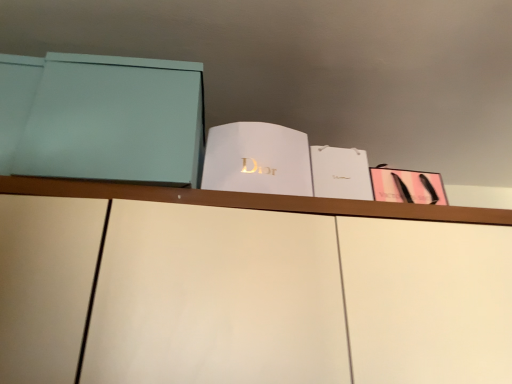
What is the approximate height of white paper at center, acting as the second paperback book starting from the left?

white paper at center, acting as the second paperback book starting from the left, is 7.68 inches tall.

Image resolution: width=512 pixels, height=384 pixels. What do you see at coordinates (340, 173) in the screenshot?
I see `white paper at center, which appears as the second paperback book when viewed from the right` at bounding box center [340, 173].

Where is `pink matte paper at upper right, positioned as the 1th paperback book in right-to-left order`? pink matte paper at upper right, positioned as the 1th paperback book in right-to-left order is located at coordinates (407, 186).

Identify the location of white paper at center, acting as the second paperback book starting from the left. (257, 159).

Is matte teal box at left, marked as the first paperback book in a left-to-right arrangement, looking in the opposite direction of pink matte paper at upper right, which is counted as the fourth paperback book, starting from the left?

No, matte teal box at left, marked as the first paperback book in a left-to-right arrangement, is not facing the opposite direction of pink matte paper at upper right, which is counted as the fourth paperback book, starting from the left.

In order to click on paperback book that is the 3rd object directly below the matte teal box at left, marked as the first paperback book in a left-to-right arrangement (from a real-world perspective) in this screenshot , I will do `click(407, 186)`.

Between matte teal box at left, which is the 4th paperback book in right-to-left order, and pink matte paper at upper right, which is counted as the fourth paperback book, starting from the left, which one has smaller width?

With smaller width is pink matte paper at upper right, which is counted as the fourth paperback book, starting from the left.

From the image's perspective, is matte teal box at left, marked as the first paperback book in a left-to-right arrangement, above pink matte paper at upper right, positioned as the 1th paperback book in right-to-left order?

Indeed, from the image's perspective, matte teal box at left, marked as the first paperback book in a left-to-right arrangement, is shown above pink matte paper at upper right, positioned as the 1th paperback book in right-to-left order.

Considering the positions of points (344, 160) and (130, 120), is point (344, 160) closer to camera compared to point (130, 120)?

No, it is not.

Does white paper at center, which appears as the second paperback book when viewed from the right, come in front of matte teal box at left, marked as the first paperback book in a left-to-right arrangement?

No.

Is white paper at center, which appears as the second paperback book when viewed from the right, wider than matte teal box at left, marked as the first paperback book in a left-to-right arrangement?

No.

Could you measure the distance between white paper at center, arranged as the 3th paperback book when viewed from the left, and matte teal box at left, marked as the first paperback book in a left-to-right arrangement?

A distance of 18.96 inches exists between white paper at center, arranged as the 3th paperback book when viewed from the left, and matte teal box at left, marked as the first paperback book in a left-to-right arrangement.

Measure the distance from pink matte paper at upper right, which is counted as the fourth paperback book, starting from the left, to white paper at center, acting as the second paperback book starting from the left.

pink matte paper at upper right, which is counted as the fourth paperback book, starting from the left, is 27.92 centimeters from white paper at center, acting as the second paperback book starting from the left.

From the image's perspective, which is below, pink matte paper at upper right, which is counted as the fourth paperback book, starting from the left, or white paper at center, marked as the 3th paperback book in a right-to-left arrangement?

pink matte paper at upper right, which is counted as the fourth paperback book, starting from the left, is shown below in the image.

Does pink matte paper at upper right, which is counted as the fourth paperback book, starting from the left, have a larger size compared to white paper at center, acting as the second paperback book starting from the left?

No, pink matte paper at upper right, which is counted as the fourth paperback book, starting from the left, is not bigger than white paper at center, acting as the second paperback book starting from the left.

Does pink matte paper at upper right, which is counted as the fourth paperback book, starting from the left, have a greater width compared to white paper at center, acting as the second paperback book starting from the left?

No, pink matte paper at upper right, which is counted as the fourth paperback book, starting from the left, is not wider than white paper at center, acting as the second paperback book starting from the left.

Between white paper at center, arranged as the 3th paperback book when viewed from the left, and pink matte paper at upper right, which is counted as the fourth paperback book, starting from the left, which one appears on the right side from the viewer's perspective?

pink matte paper at upper right, which is counted as the fourth paperback book, starting from the left.

Is point (323, 169) more distant than point (401, 184)?

That is False.

Choose the correct answer: Is white paper at center, arranged as the 3th paperback book when viewed from the left, inside pink matte paper at upper right, which is counted as the fourth paperback book, starting from the left, or outside it?

The correct answer is: outside.

The width and height of the screenshot is (512, 384). In order to click on paperback book to the right of white paper at center, which appears as the second paperback book when viewed from the right in this screenshot , I will do click(407, 186).

From the picture: Choose the correct answer: Is pink matte paper at upper right, positioned as the 1th paperback book in right-to-left order, inside white paper at center, which appears as the second paperback book when viewed from the right, or outside it?

pink matte paper at upper right, positioned as the 1th paperback book in right-to-left order, is outside white paper at center, which appears as the second paperback book when viewed from the right.

From a real-world perspective, between pink matte paper at upper right, positioned as the 1th paperback book in right-to-left order, and white paper at center, arranged as the 3th paperback book when viewed from the left, who is vertically higher?

In real-world perspective, white paper at center, arranged as the 3th paperback book when viewed from the left, is above.

Between pink matte paper at upper right, positioned as the 1th paperback book in right-to-left order, and white paper at center, which appears as the second paperback book when viewed from the right, which one appears on the right side from the viewer's perspective?

From the viewer's perspective, pink matte paper at upper right, positioned as the 1th paperback book in right-to-left order, appears more on the right side.

This screenshot has height=384, width=512. Find the location of `the 1st paperback book below the white paper at center, acting as the second paperback book starting from the left (from the image's perspective)`. the 1st paperback book below the white paper at center, acting as the second paperback book starting from the left (from the image's perspective) is located at coordinates (340, 173).

Is white paper at center, which appears as the second paperback book when viewed from the right, taller or shorter than white paper at center, acting as the second paperback book starting from the left?

In the image, white paper at center, which appears as the second paperback book when viewed from the right, appears to be shorter than white paper at center, acting as the second paperback book starting from the left.

Based on the photo, can you confirm if white paper at center, acting as the second paperback book starting from the left, is positioned to the right of white paper at center, which appears as the second paperback book when viewed from the right?

In fact, white paper at center, acting as the second paperback book starting from the left, is to the left of white paper at center, which appears as the second paperback book when viewed from the right.

From the image's perspective, which object appears higher, white paper at center, acting as the second paperback book starting from the left, or white paper at center, which appears as the second paperback book when viewed from the right?

From the image's view, white paper at center, acting as the second paperback book starting from the left, is above.

Is white paper at center, marked as the 3th paperback book in a right-to-left arrangement, situated inside white paper at center, which appears as the second paperback book when viewed from the right, or outside?

white paper at center, marked as the 3th paperback book in a right-to-left arrangement, cannot be found inside white paper at center, which appears as the second paperback book when viewed from the right.

Measure the distance between white paper at center, marked as the 3th paperback book in a right-to-left arrangement, and white paper at center, arranged as the 3th paperback book when viewed from the left.

white paper at center, marked as the 3th paperback book in a right-to-left arrangement, is 4.72 inches away from white paper at center, arranged as the 3th paperback book when viewed from the left.

Locate an element on the screen. The width and height of the screenshot is (512, 384). paperback book that is the 3rd one above the pink matte paper at upper right, positioned as the 1th paperback book in right-to-left order (from a real-world perspective) is located at coordinates point(102,118).

Image resolution: width=512 pixels, height=384 pixels. I want to click on the 2nd paperback book to the right when counting from the matte teal box at left, which is the 4th paperback book in right-to-left order, so click(x=340, y=173).

From the picture: Based on their spatial positions, is white paper at center, marked as the 3th paperback book in a right-to-left arrangement, or white paper at center, arranged as the 3th paperback book when viewed from the left, closer to pink matte paper at upper right, which is counted as the fourth paperback book, starting from the left?

white paper at center, arranged as the 3th paperback book when viewed from the left.

Considering their positions, is matte teal box at left, which is the 4th paperback book in right-to-left order, positioned further to pink matte paper at upper right, positioned as the 1th paperback book in right-to-left order, than white paper at center, acting as the second paperback book starting from the left?

matte teal box at left, which is the 4th paperback book in right-to-left order, is positioned further to the anchor pink matte paper at upper right, positioned as the 1th paperback book in right-to-left order.

From the image, which object appears to be nearer to white paper at center, marked as the 3th paperback book in a right-to-left arrangement, white paper at center, which appears as the second paperback book when viewed from the right, or pink matte paper at upper right, which is counted as the fourth paperback book, starting from the left?

white paper at center, which appears as the second paperback book when viewed from the right.

When comparing their distances from pink matte paper at upper right, positioned as the 1th paperback book in right-to-left order, does white paper at center, marked as the 3th paperback book in a right-to-left arrangement, or matte teal box at left, marked as the first paperback book in a left-to-right arrangement, seem closer?

white paper at center, marked as the 3th paperback book in a right-to-left arrangement.

Consider the image. Looking at the image, which one is located further to white paper at center, which appears as the second paperback book when viewed from the right, pink matte paper at upper right, which is counted as the fourth paperback book, starting from the left, or white paper at center, acting as the second paperback book starting from the left?

white paper at center, acting as the second paperback book starting from the left, is positioned further to the anchor white paper at center, which appears as the second paperback book when viewed from the right.

Considering their positions, is pink matte paper at upper right, which is counted as the fourth paperback book, starting from the left, positioned closer to white paper at center, arranged as the 3th paperback book when viewed from the left, than matte teal box at left, marked as the first paperback book in a left-to-right arrangement?

Based on the image, pink matte paper at upper right, which is counted as the fourth paperback book, starting from the left, appears to be nearer to white paper at center, arranged as the 3th paperback book when viewed from the left.

Looking at the image, which one is located further to white paper at center, marked as the 3th paperback book in a right-to-left arrangement, white paper at center, which appears as the second paperback book when viewed from the right, or matte teal box at left, marked as the first paperback book in a left-to-right arrangement?

matte teal box at left, marked as the first paperback book in a left-to-right arrangement, is further to white paper at center, marked as the 3th paperback book in a right-to-left arrangement.

From the image, which object appears to be nearer to pink matte paper at upper right, positioned as the 1th paperback book in right-to-left order, matte teal box at left, which is the 4th paperback book in right-to-left order, or white paper at center, arranged as the 3th paperback book when viewed from the left?

Among the two, white paper at center, arranged as the 3th paperback book when viewed from the left, is located nearer to pink matte paper at upper right, positioned as the 1th paperback book in right-to-left order.

You are a GUI agent. You are given a task and a screenshot of the screen. Output one action in this format:
    pyautogui.click(x=<x>, y=<y>)
    Task: Click on the paperback book between matte teal box at left, marked as the first paperback book in a left-to-right arrangement, and white paper at center, arranged as the 3th paperback book when viewed from the left, from left to right
    
    Given the screenshot: What is the action you would take?
    pyautogui.click(x=257, y=159)

Where is `paperback book between white paper at center, acting as the second paperback book starting from the left, and pink matte paper at upper right, which is counted as the fourth paperback book, starting from the left, from left to right`? paperback book between white paper at center, acting as the second paperback book starting from the left, and pink matte paper at upper right, which is counted as the fourth paperback book, starting from the left, from left to right is located at coordinates (340, 173).